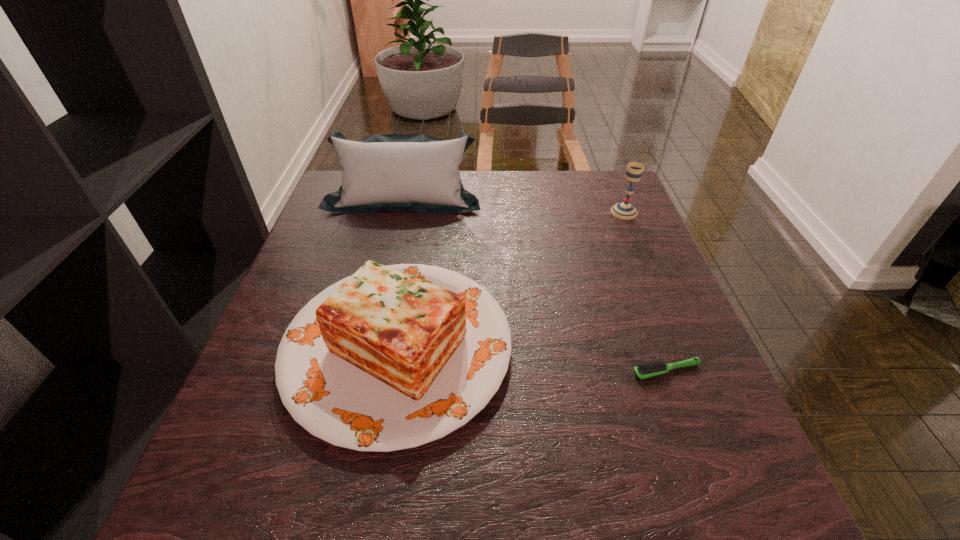
You are a GUI agent. You are given a task and a screenshot of the screen. Output one action in this format:
    pyautogui.click(x=<x>, y=<y>)
    Task: Click on the tallest object
    Image resolution: width=960 pixels, height=540 pixels.
    Given the screenshot: What is the action you would take?
    pyautogui.click(x=413, y=172)

You are a GUI agent. You are given a task and a screenshot of the screen. Output one action in this format:
    pyautogui.click(x=<x>, y=<y>)
    Task: Click on the chalice
    This screenshot has height=540, width=960.
    Given the screenshot: What is the action you would take?
    pyautogui.click(x=624, y=210)

Find the location of a particular element. This screenshot has width=960, height=540. lasagna is located at coordinates (392, 357).

The width and height of the screenshot is (960, 540). In order to click on hairbrush in this screenshot , I will do `click(652, 369)`.

Locate an element on the screen. This screenshot has width=960, height=540. free space located 0.290m on the surface of the cushion is located at coordinates (382, 292).

Where is `vacant space situated 0.140m on the front of the chalice`? The image size is (960, 540). vacant space situated 0.140m on the front of the chalice is located at coordinates (641, 254).

Identify the location of free space located 0.350m on the right of the lasagna. (694, 347).

Find the location of `free location located 0.090m on the front of the shortest object`. free location located 0.090m on the front of the shortest object is located at coordinates (687, 429).

The height and width of the screenshot is (540, 960). I want to click on cushion located in the far edge section of the desktop, so click(x=413, y=172).

At what (x,y) coordinates should I click in order to perform the action: click on chalice present at the far edge. Please return your answer as a coordinate pair (x, y). This screenshot has height=540, width=960. Looking at the image, I should click on (624, 210).